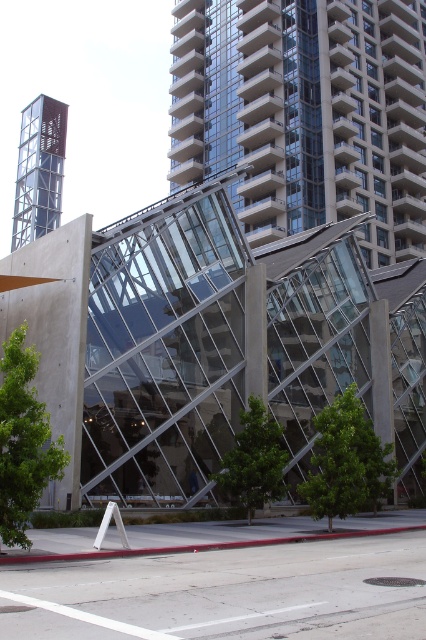
Can you confirm if glassy concrete building at upper center is shorter than clear glass elevator at upper left?

Incorrect, glassy concrete building at upper center's height does not fall short of clear glass elevator at upper left's.

Does glassy concrete building at upper center have a smaller size compared to clear glass elevator at upper left?

No.

Is point (380, 243) closer to viewer compared to point (63, 131)?

Yes, it is in front of point (63, 131).

You are a GUI agent. You are given a task and a screenshot of the screen. Output one action in this format:
    pyautogui.click(x=<x>, y=<y>)
    Task: Click on the glassy concrete building at upper center
    The width and height of the screenshot is (426, 640).
    Given the screenshot: What is the action you would take?
    pyautogui.click(x=305, y=113)